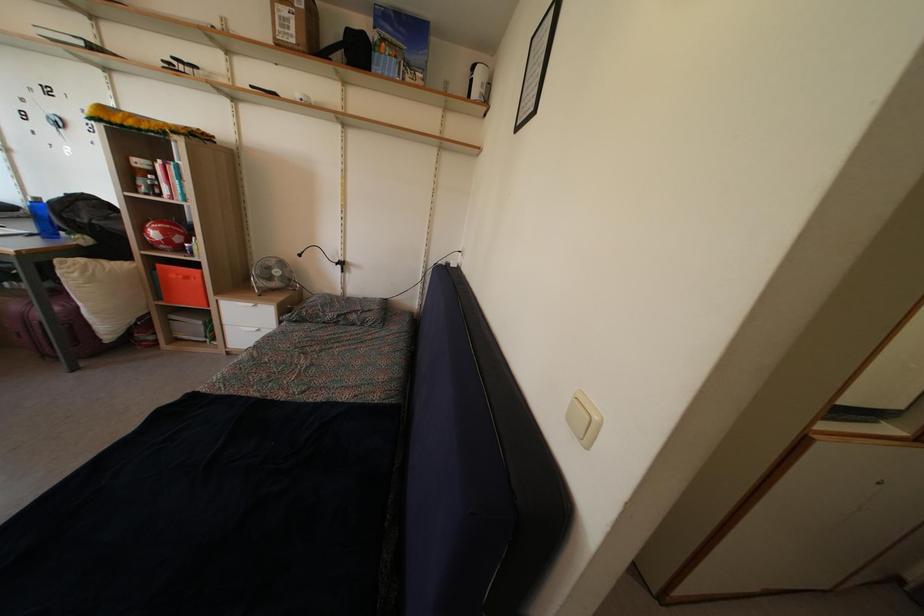
Locate an element on the screen. This screenshot has height=616, width=924. flexible lamp neck is located at coordinates (312, 252).